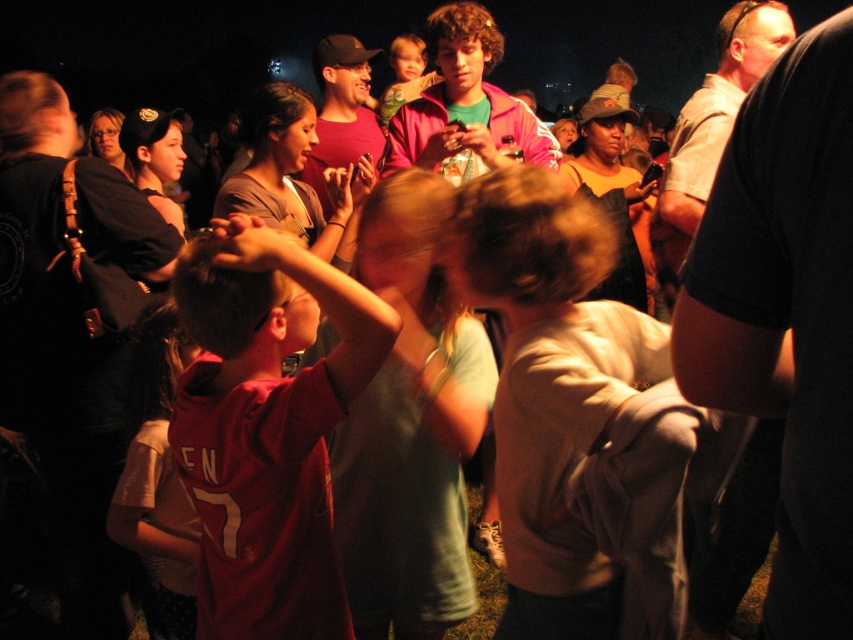
You are at a nighttime event and want to give a gift to the person wearing the matte red shirt at center. However, you are standing near the red jersey at center. Can you hand the gift directly without moving closer? Please consider the distance between them.

The distance between the matte red shirt at center and the red jersey at center is 28.52 inches. Since this distance is relatively short, you can likely hand the gift directly without needing to move closer, as 28.52 inches is within a comfortable reaching distance for most people.

You are organizing a costume party and need to decide which outfit to wear. You have a light brown cotton shirt at center and a red jersey at center. Which one would you choose if you want to stand out more in the crowd?

The light brown cotton shirt at center is larger in size than the red jersey at center, so choosing the light brown cotton shirt at center would make you stand out more due to its larger size.